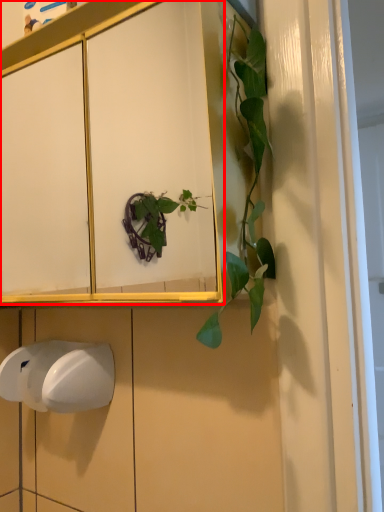
Question: From the image's perspective, what is the correct spatial positioning of cabinetry (annotated by the red box) in reference to hand dryer?

Choices:
 (A) above
 (B) below

Answer: (A)